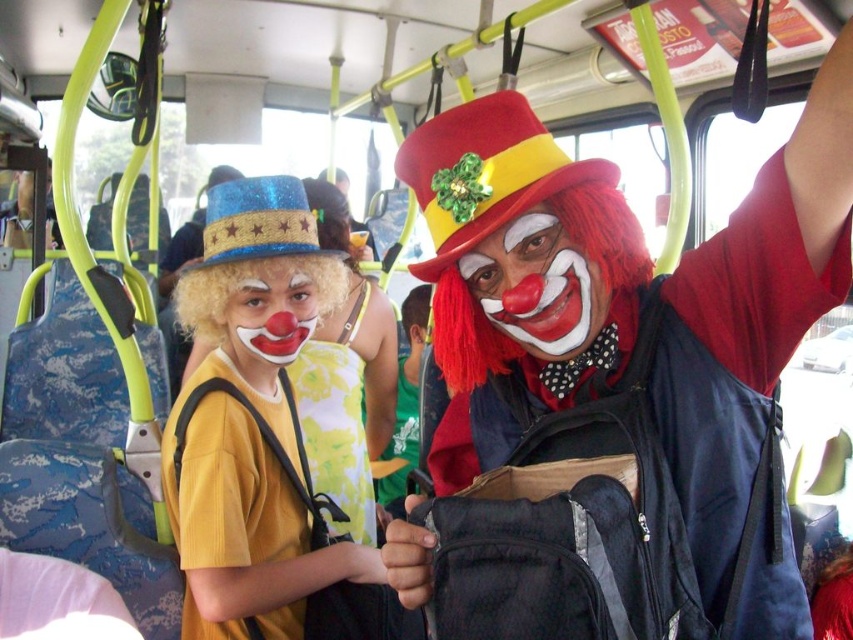
Question: Among these objects, which one is nearest to the camera?

Choices:
 (A) matte clown nose at center
 (B) green jersey at center

Answer: (A)

Question: In this image, where is matte red clown at upper right located relative to yellow floral fabric dress at center?

Choices:
 (A) left
 (B) right

Answer: (B)

Question: Considering the relative positions of matte red clown at upper right and yellow floral fabric dress at center in the image provided, where is matte red clown at upper right located with respect to yellow floral fabric dress at center?

Choices:
 (A) above
 (B) below

Answer: (A)

Question: Is matte yellow shirt at center above matte clown nose at center?

Choices:
 (A) yes
 (B) no

Answer: (B)

Question: Which object is positioned closest to the green jersey at center?

Choices:
 (A) matte yellow shirt at center
 (B) matte clown nose at center
 (C) yellow floral fabric dress at center
 (D) matte clown face at center

Answer: (C)

Question: Which of the following is the closest to the observer?

Choices:
 (A) (404, 452)
 (B) (674, 500)
 (C) (548, 346)
 (D) (254, 179)

Answer: (B)